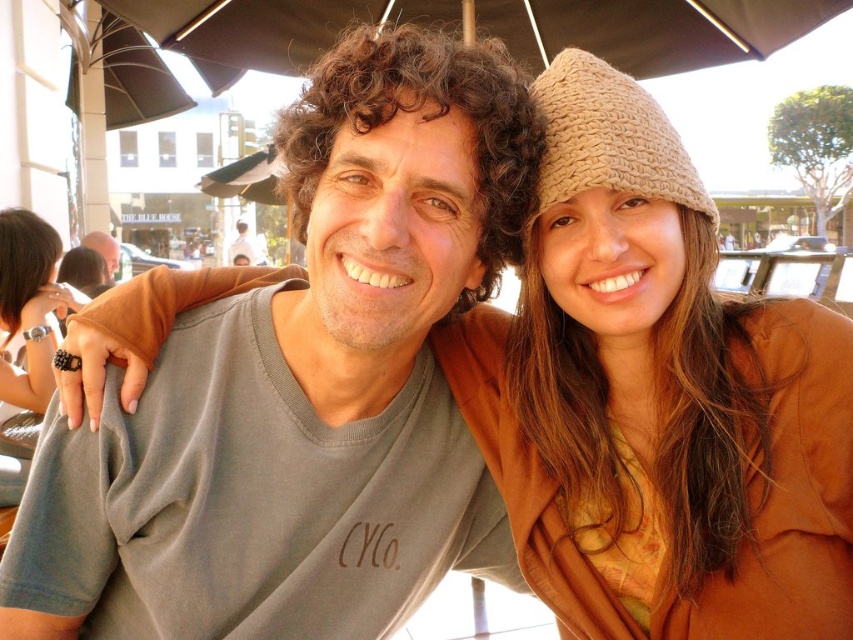
Question: Can you confirm if brown knitted hat at upper right is bigger than matte black ring at lower left?

Choices:
 (A) no
 (B) yes

Answer: (A)

Question: Can you confirm if brown knitted hat at upper right is bigger than brown woven umbrella at upper center?

Choices:
 (A) yes
 (B) no

Answer: (A)

Question: Does matte black ring at lower left appear under matte gray t-shirt at center?

Choices:
 (A) yes
 (B) no

Answer: (A)

Question: Which of these objects is positioned closest to the matte black ring at lower left?

Choices:
 (A) matte black shirt at left
 (B) matte gray t-shirt at center

Answer: (A)

Question: Which is farther from the matte black ring at lower left?

Choices:
 (A) matte gray t-shirt at center
 (B) brown knitted hat at upper right
 (C) brown woven umbrella at upper center

Answer: (A)

Question: Which point appears farthest from the camera in this image?

Choices:
 (A) (111, 236)
 (B) (585, 131)

Answer: (A)